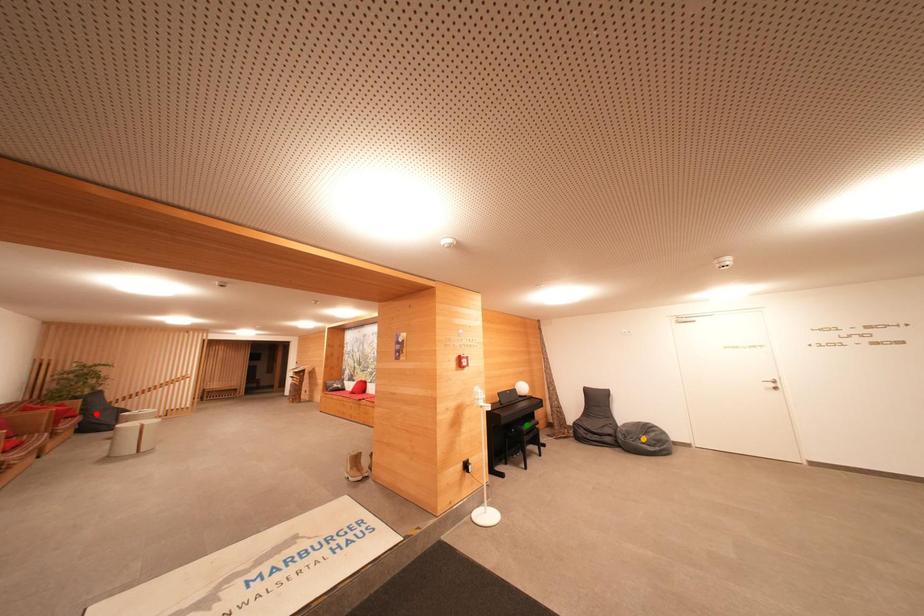
Order these from nearest to farthest:
1. orange point
2. green point
3. red point

1. red point
2. green point
3. orange point